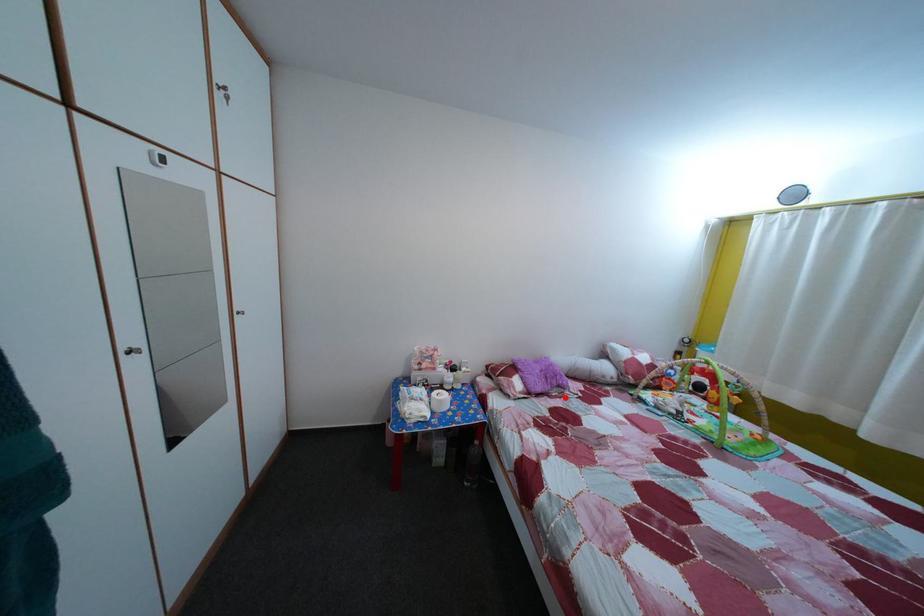
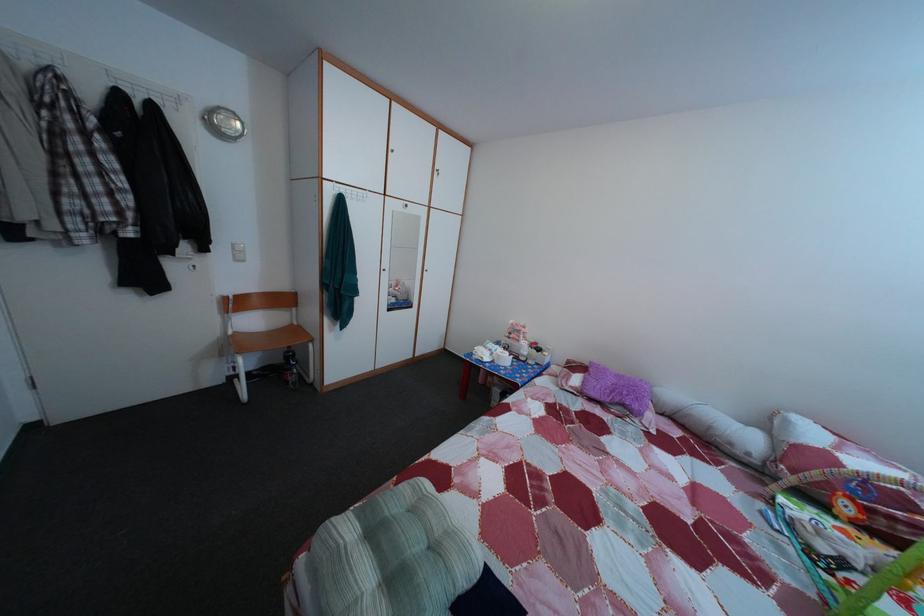
Question: I am providing you with two images of the same scene from different viewpoints. In image1, a red point is highlighted. Considering the same 3D point in image2, which of the following is correct?

Choices:
 (A) It is closer
 (B) It is farther

Answer: (A)